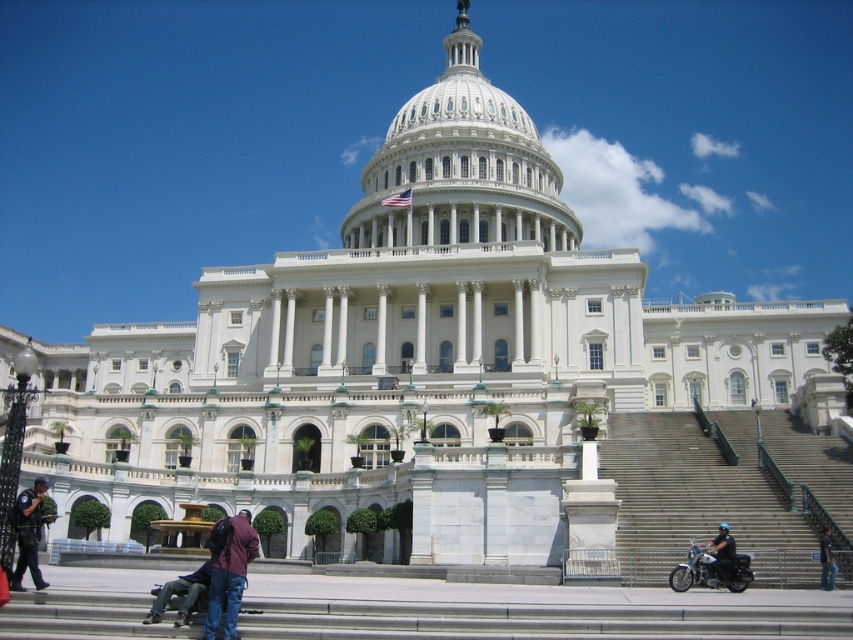
Question: Which object is the closest to the shiny chrome motorcycle at lower right?

Choices:
 (A) gray concrete stairs at lower right
 (B) maroon fabric jacket at lower left
 (C) white marble dome at center
 (D) denim pants at lower left

Answer: (A)

Question: Does gray concrete stairs at lower right appear over white marble dome at center?

Choices:
 (A) yes
 (B) no

Answer: (B)

Question: Which of the following is the farthest from the observer?

Choices:
 (A) (664, 413)
 (B) (709, 556)
 (C) (33, 538)
 (D) (722, 538)

Answer: (A)

Question: Is maroon fabric jacket at lower left to the left of jeans at lower right from the viewer's perspective?

Choices:
 (A) yes
 (B) no

Answer: (A)

Question: Which of the following is the farthest from the observer?

Choices:
 (A) (521, 211)
 (B) (241, 525)
 (C) (30, 512)

Answer: (A)

Question: Does gray concrete stairs at lower right appear over jeans at lower right?

Choices:
 (A) no
 (B) yes

Answer: (B)